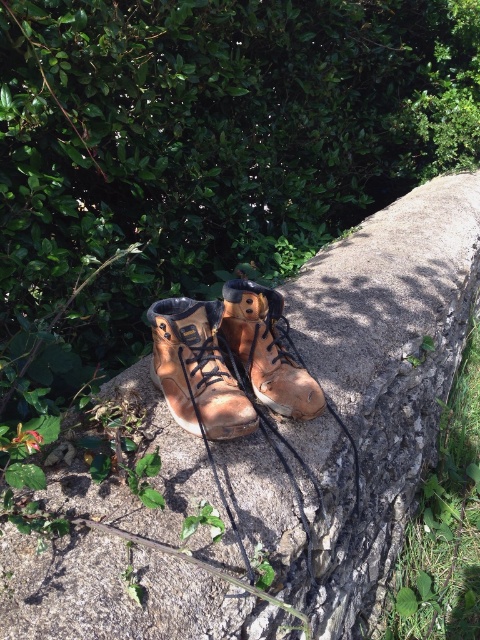
Question: Which point is farther to the camera?

Choices:
 (A) rusty concrete wall at center
 (B) leather boot at center
 (C) brown leather boot at center

Answer: (C)

Question: Based on their relative distances, which object is nearer to the brown leather boot at center?

Choices:
 (A) rusty concrete wall at center
 (B) leather boot at center

Answer: (B)

Question: Is rusty concrete wall at center bigger than brown leather boot at center?

Choices:
 (A) yes
 (B) no

Answer: (A)

Question: Estimate the real-world distances between objects in this image. Which object is farther from the leather boot at center?

Choices:
 (A) brown leather boot at center
 (B) rusty concrete wall at center

Answer: (B)

Question: Is rusty concrete wall at center thinner than leather boot at center?

Choices:
 (A) yes
 (B) no

Answer: (B)

Question: Can you confirm if rusty concrete wall at center is positioned above brown leather boot at center?

Choices:
 (A) yes
 (B) no

Answer: (B)